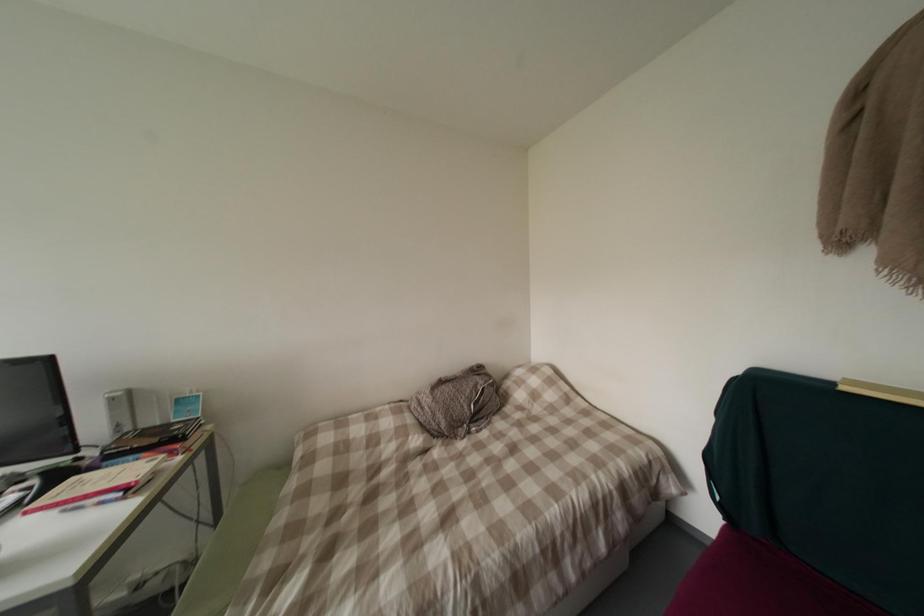
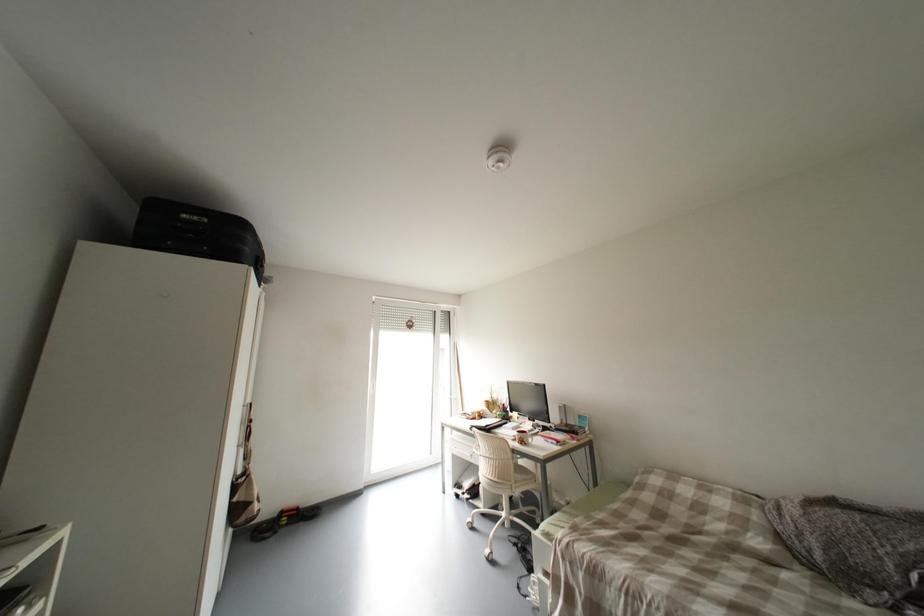
Question: The camera is either moving clockwise (left) or counter-clockwise (right) around the object. The first image is from the beginning of the video and the second image is from the end. Is the camera moving left or right when shooting the video?

Choices:
 (A) Left
 (B) Right

Answer: (B)